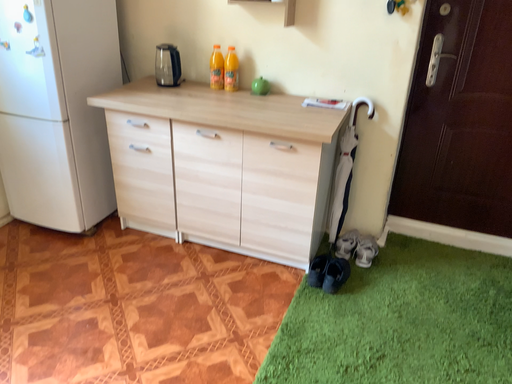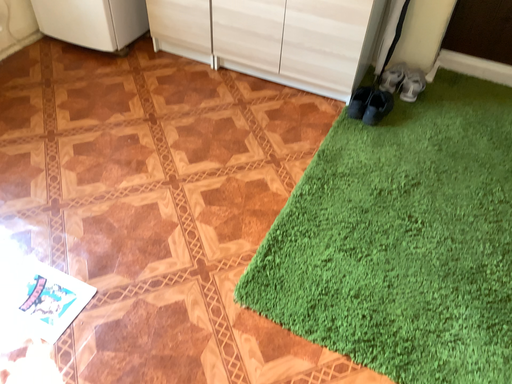
Question: How did the camera likely rotate when shooting the video?

Choices:
 (A) rotated upward
 (B) rotated downward

Answer: (B)